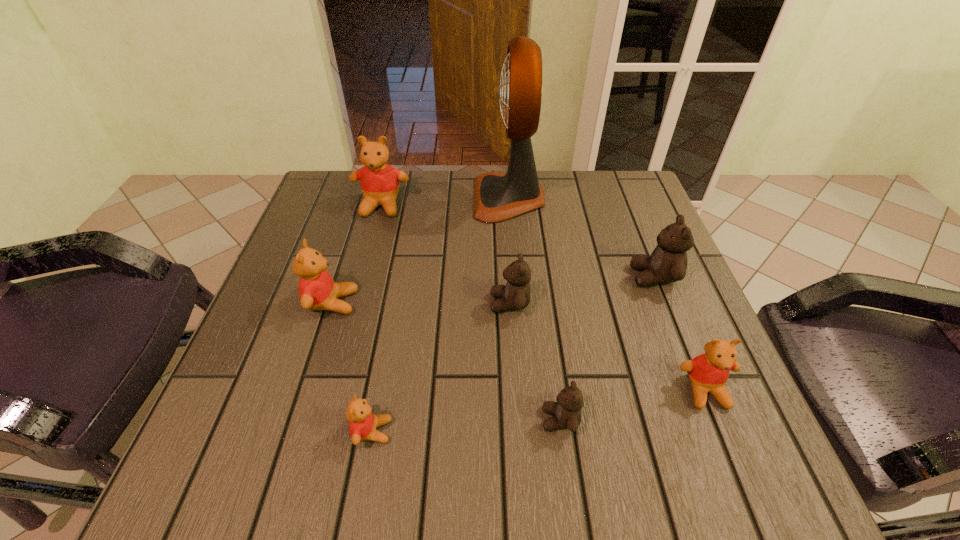
Identify the location of the nearest brown teddy bear. [x=566, y=412].

In order to click on the smallest red teddy bear in this screenshot , I will do `click(363, 423)`.

Locate an element on the screen. The width and height of the screenshot is (960, 540). free region located 0.230m on the front-facing side of the tallest object is located at coordinates (387, 198).

You are a GUI agent. You are given a task and a screenshot of the screen. Output one action in this format:
    pyautogui.click(x=<x>, y=<y>)
    Task: Click on the vacant point located 0.300m on the front-facing side of the tallest object
    
    Given the screenshot: What is the action you would take?
    pyautogui.click(x=360, y=198)

Locate an element on the screen. free region located on the front-facing side of the tallest object is located at coordinates (432, 198).

This screenshot has width=960, height=540. Identify the location of vacant space located on the front-facing side of the tallest teddy bear. (353, 312).

The image size is (960, 540). Identify the location of free space located on the face of the rightmost brown teddy bear. (496, 276).

Where is `free space located on the face of the rightmost brown teddy bear`? Image resolution: width=960 pixels, height=540 pixels. free space located on the face of the rightmost brown teddy bear is located at coordinates (478, 276).

The width and height of the screenshot is (960, 540). In order to click on free location located 0.260m on the face of the rightmost brown teddy bear in this screenshot , I will do `click(510, 276)`.

Find the location of a particular element. vacant position located 0.260m on the front-facing side of the third smallest red teddy bear is located at coordinates (484, 302).